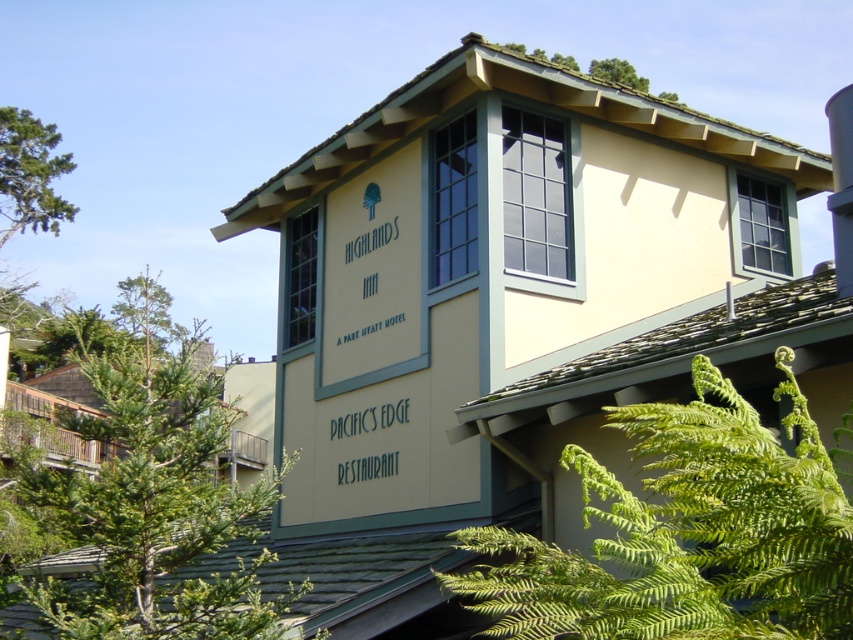
Between green leafy tree at center and green leafy tree at upper center, which one is positioned lower?

green leafy tree at center is below.

Is green leafy tree at center smaller than green leafy tree at upper center?

Yes.

Is point (219, 515) farther from camera compared to point (561, 58)?

No, it is not.

Find the location of a particular element. The width and height of the screenshot is (853, 640). green leafy tree at center is located at coordinates (152, 493).

Between point (795, 401) and point (534, 51), which one is positioned in front?

Point (795, 401)

Identify the location of green leafy fern at lower right. The image size is (853, 640). (686, 532).

What are the coordinates of `green leafy fern at lower right` in the screenshot? It's located at (686, 532).

Is green leafy fern at lower right positioned before green leafy tree at center?

Yes, it is in front of green leafy tree at center.

Based on the photo, can you confirm if green leafy fern at lower right is positioned above green leafy tree at center?

Yes.

Image resolution: width=853 pixels, height=640 pixels. What do you see at coordinates (686, 532) in the screenshot? I see `green leafy fern at lower right` at bounding box center [686, 532].

In order to click on green leafy fern at lower right in this screenshot , I will do `click(686, 532)`.